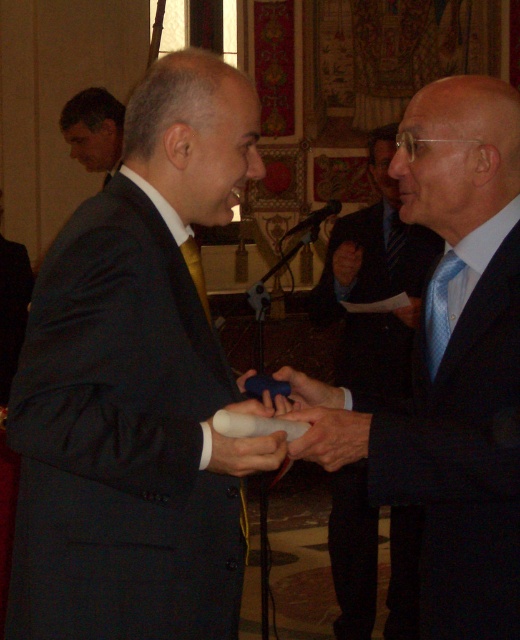
Question: Among these objects, which one is nearest to the camera?

Choices:
 (A) smooth leather hand at center
 (B) blue dotted tie at right
 (C) blue rubber glove at center
 (D) blue silk tie at right

Answer: (A)

Question: Is matte black suit at upper left further to camera compared to blue rubber glove at center?

Choices:
 (A) yes
 (B) no

Answer: (A)

Question: Which object appears closest to the camera in this image?

Choices:
 (A) blue silk tie at right
 (B) smooth leather hand at center

Answer: (B)

Question: Can you confirm if matte black suit at right is positioned to the right of matte black suit at upper left?

Choices:
 (A) yes
 (B) no

Answer: (A)

Question: Which object is farther from the camera taking this photo?

Choices:
 (A) blue rubber glove at center
 (B) matte black suit at center
 (C) blue silk tie at right

Answer: (A)

Question: Is smooth leather hand at center bigger than blue rubber glove at center?

Choices:
 (A) no
 (B) yes

Answer: (B)